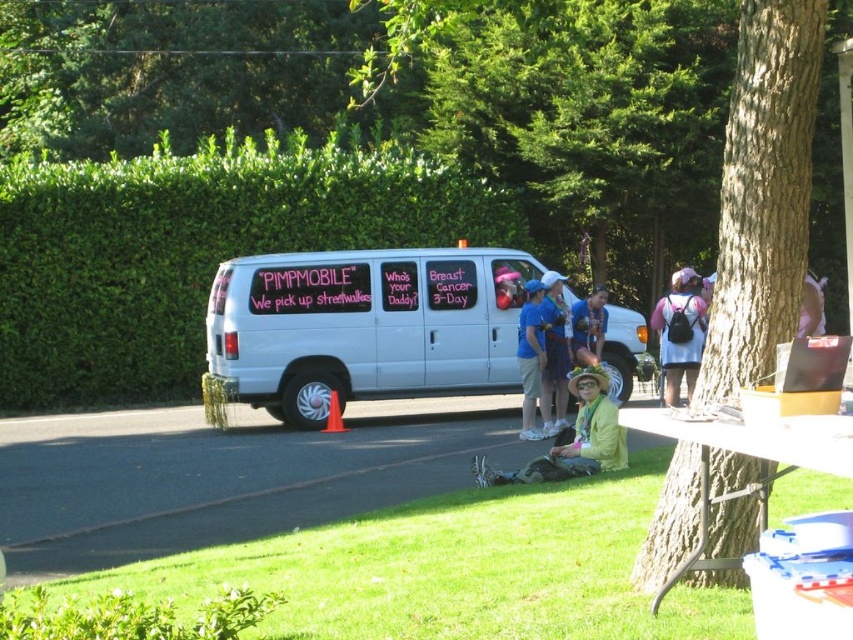
You are standing in front of the white van at the community event. There are two points marked on the van, one at coordinates point (x=515, y=349) and the other at point (x=582, y=344). Which point is closer to you?

Point (x=515, y=349) is closer to you because it is further to the viewer than point (x=582, y=344).

Consider the image. You are a photographer at the event and need to capture both the yellow fabric jacket at lower center and the blue fabric shirt at center in a single shot. Which clothing item should you focus on first to ensure both are in frame?

You should focus on the blue fabric shirt at center first because the yellow fabric jacket at lower center is positioned under it, so adjusting the camera angle to include the lower area will also capture the blue fabric shirt at center.

You are a pedestrian standing in front of the white matte van at center and the yellow fabric jacket at lower center. Which object is closer to you?

The white matte van at center is closer to you because it is positioned further to the viewer than the yellow fabric jacket at lower center.